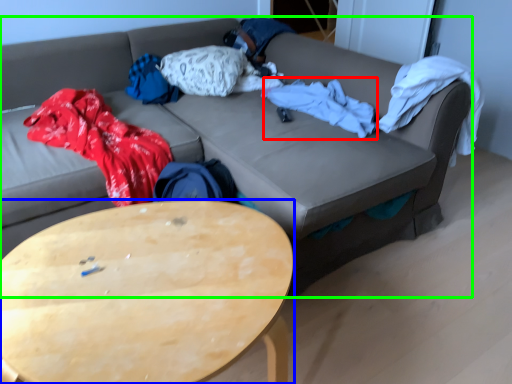
Question: Which is farther away from blanket (highlighted by a red box)? coffee table (highlighted by a blue box) or studio couch (highlighted by a green box)?

Choices:
 (A) coffee table
 (B) studio couch

Answer: (A)